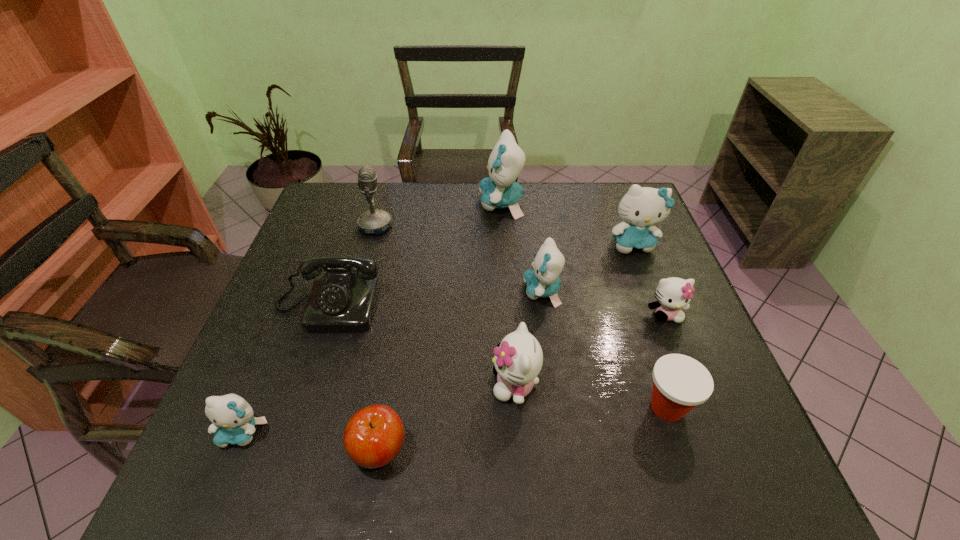
In order to click on the biggest blue kitten in this screenshot , I will do `click(499, 190)`.

Identify the location of the farthest blue kitten. (499, 190).

Where is `microphone`? microphone is located at coordinates (374, 221).

What are the coordinates of `the rightmost blue kitten` in the screenshot? It's located at (641, 207).

Image resolution: width=960 pixels, height=540 pixels. Identify the location of the third nearest blue kitten. (641, 207).

Locate an element on the screen. This screenshot has width=960, height=540. the second nearest blue kitten is located at coordinates (543, 280).

At what (x,y) coordinates should I click in order to perform the action: click on the nearer white kitten. Please return your answer as a coordinate pair (x, y). The width and height of the screenshot is (960, 540). Looking at the image, I should click on (518, 359).

Find the location of `the bigger white kitten`. the bigger white kitten is located at coordinates (518, 359).

Find the location of `black telephone`. black telephone is located at coordinates (343, 300).

Image resolution: width=960 pixels, height=540 pixels. Find the location of `the right white kitten`. the right white kitten is located at coordinates (673, 293).